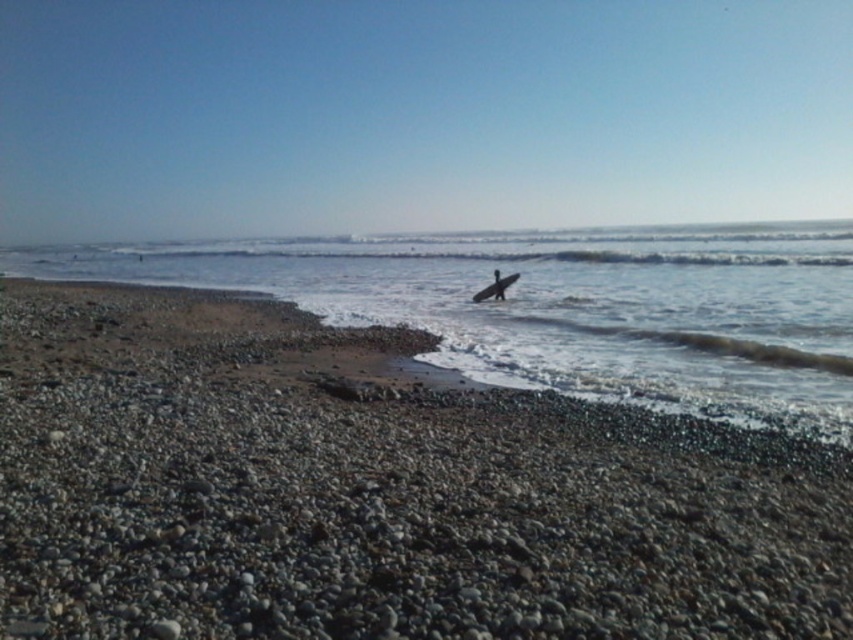
Question: Which object appears farthest from the camera in this image?

Choices:
 (A) smooth pebbles at center
 (B) black matte surfboard at center
 (C) smooth dark skin at center

Answer: (C)

Question: Estimate the real-world distances between objects in this image. Which object is closer to the clear water at center?

Choices:
 (A) smooth pebbles at center
 (B) black matte surfboard at center

Answer: (A)

Question: Can you confirm if clear water at center is positioned to the right of black matte surfboard at center?

Choices:
 (A) no
 (B) yes

Answer: (A)

Question: From the image, what is the correct spatial relationship of smooth pebbles at center in relation to smooth dark skin at center?

Choices:
 (A) left
 (B) right

Answer: (A)

Question: Which object is positioned farthest from the smooth pebbles at center?

Choices:
 (A) clear water at center
 (B) black matte surfboard at center
 (C) smooth dark skin at center

Answer: (A)

Question: Is black matte surfboard at center thinner than smooth dark skin at center?

Choices:
 (A) yes
 (B) no

Answer: (B)